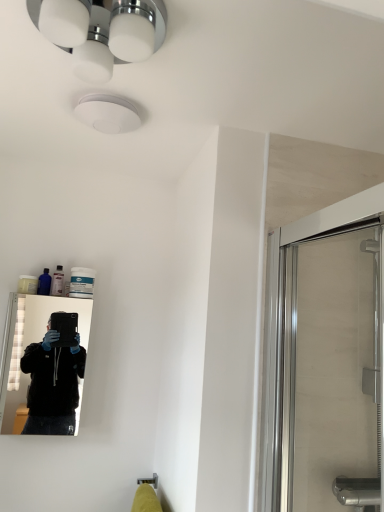
Question: From a real-world perspective, relative to transparent glass shower door at right, is black glossy mirror at left vertically above or below?

Choices:
 (A) above
 (B) below

Answer: (B)

Question: In the image, is black glossy mirror at left on the left side or the right side of transparent glass shower door at right?

Choices:
 (A) left
 (B) right

Answer: (A)

Question: Considering the real-world distances, which object is closest to the transparent glass shower door at right?

Choices:
 (A) translucent plastic bottle at upper left
 (B) black glossy mirror at left
 (C) white glossy light fixture at upper center

Answer: (C)

Question: Which is farther from the translucent plastic bottle at upper left?

Choices:
 (A) white glossy light fixture at upper center
 (B) black glossy mirror at left
 (C) transparent glass shower door at right

Answer: (B)